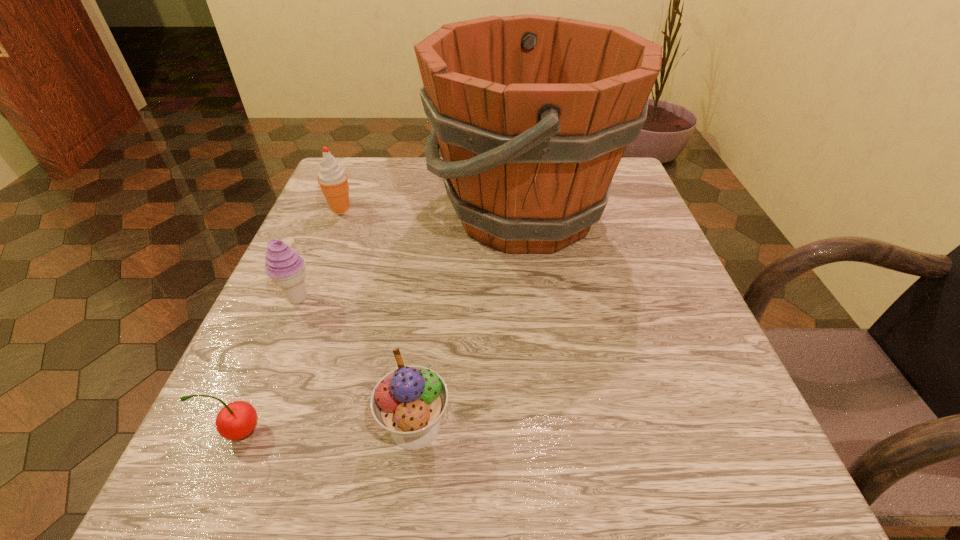
Identify the location of the tallest object. (532, 114).

Find the location of a particular element. the farthest icecream is located at coordinates (333, 180).

Locate an element on the screen. the second nearest icecream is located at coordinates (284, 265).

Locate an element on the screen. The height and width of the screenshot is (540, 960). the rightmost icecream is located at coordinates (408, 402).

At what (x,y) coordinates should I click in order to perform the action: click on cherry. Please return your answer as a coordinate pair (x, y). Looking at the image, I should click on (236, 420).

At what (x,y) coordinates should I click in order to perform the action: click on free space located on the handle side of the tallest object. Please return your answer as a coordinate pair (x, y). The width and height of the screenshot is (960, 540). Looking at the image, I should click on (342, 213).

At what (x,y) coordinates should I click in order to perform the action: click on free location located 0.060m on the handle side of the tallest object. Please return your answer as a coordinate pair (x, y). The width and height of the screenshot is (960, 540). Looking at the image, I should click on (401, 213).

Locate an element on the screen. The image size is (960, 540). vacant space positioned on the handle side of the tallest object is located at coordinates (327, 213).

Where is `free region located 0.130m on the front of the farthest icecream`? free region located 0.130m on the front of the farthest icecream is located at coordinates (321, 256).

Locate an element on the screen. The width and height of the screenshot is (960, 540). free space located on the right of the second nearest icecream is located at coordinates (362, 299).